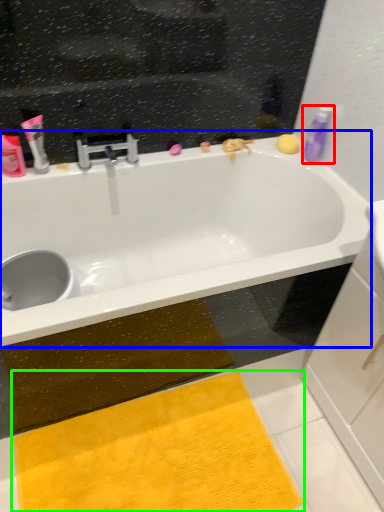
Question: Estimate the real-world distances between objects in this image. Which object is closer to toiletry (highlighted by a red box), bathtub (highlighted by a blue box) or doormat (highlighted by a green box)?

Choices:
 (A) bathtub
 (B) doormat

Answer: (A)